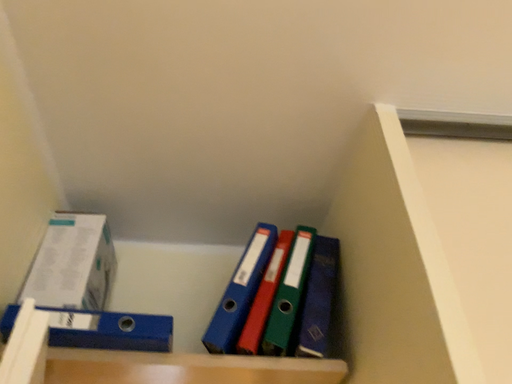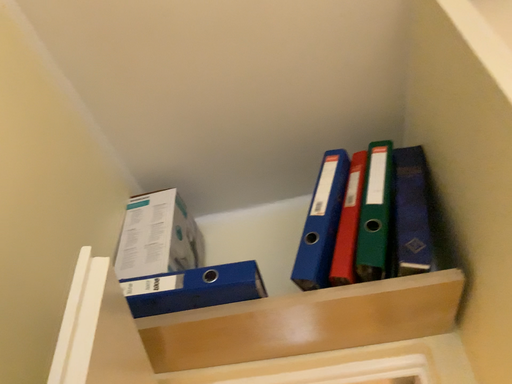
Question: How did the camera likely rotate when shooting the video?

Choices:
 (A) rotated left
 (B) rotated right

Answer: (A)